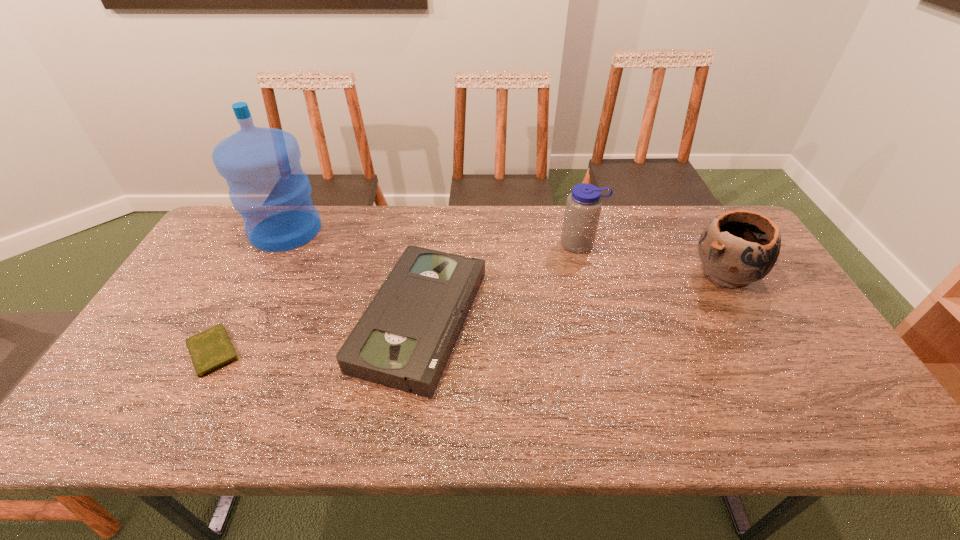
This screenshot has height=540, width=960. In order to click on vacant area that lies between the tallest object and the fourth object from left to right in this screenshot , I will do `click(433, 237)`.

I want to click on unoccupied position between the water bottle and the water jug, so click(x=433, y=237).

Where is `vacant space that is in between the water bottle and the third object from right to left`? vacant space that is in between the water bottle and the third object from right to left is located at coordinates pos(500,282).

Locate which object ranks third in proximity to the third object from left to right. Please provide its 2D coordinates. Your answer should be formatted as a tuple, i.e. [(x, y)], where the tuple contains the x and y coordinates of a point satisfying the conditions above.

[(211, 349)]

Locate which object is the third closest to the third object from left to right. Please provide its 2D coordinates. Your answer should be formatted as a tuple, i.e. [(x, y)], where the tuple contains the x and y coordinates of a point satisfying the conditions above.

[(211, 349)]

Identify the location of vacant area that satisfies the following two spatial constraints: 1. on the back side of the diary; 2. on the right side of the third object from right to left. The image size is (960, 540). (229, 320).

Find the location of a particular element. This screenshot has width=960, height=540. free point that satisfies the following two spatial constraints: 1. on the front side of the water jug; 2. on the right side of the pottery is located at coordinates (264, 273).

Locate an element on the screen. The width and height of the screenshot is (960, 540). free space that satisfies the following two spatial constraints: 1. on the back side of the rightmost object; 2. on the right side of the fourth tallest object is located at coordinates (426, 273).